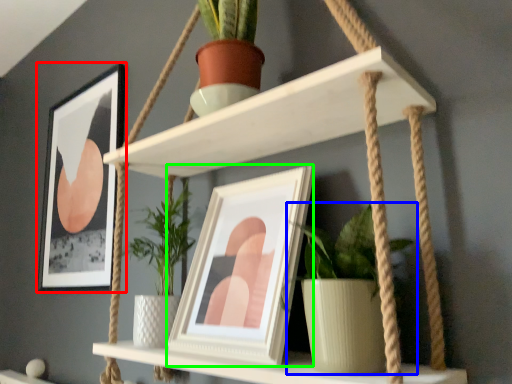
Question: Considering the real-world distances, which object is closest to picture frame (highlighted by a red box)? houseplant (highlighted by a blue box) or picture frame (highlighted by a green box).

Choices:
 (A) houseplant
 (B) picture frame

Answer: (B)